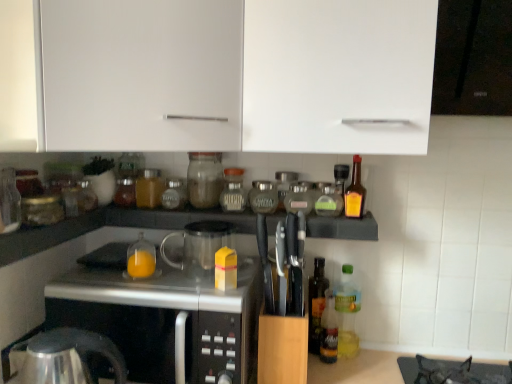
At what (x,y) coordinates should I click in order to perform the action: click on free point above satin silver microwave at center (from a real-world perspective). Please return your answer as a coordinate pair (x, y). Looking at the image, I should click on (155, 272).